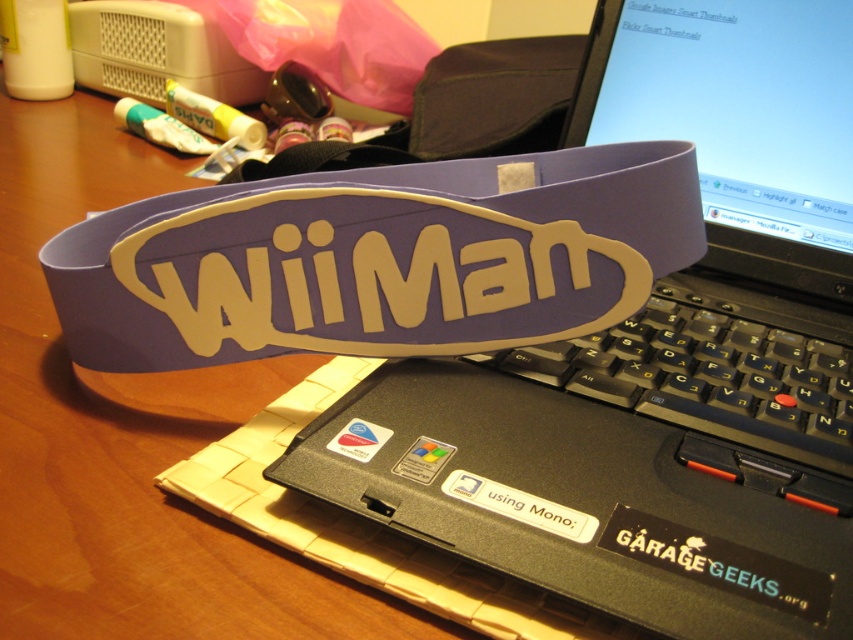
Question: Among these objects, which one is farthest from the camera?

Choices:
 (A) black plastic laptop at center
 (B) black plastic keyboard at center

Answer: (B)

Question: Can you confirm if black plastic laptop at center is positioned below black plastic keyboard at center?

Choices:
 (A) no
 (B) yes

Answer: (A)

Question: In this image, where is black plastic laptop at center located relative to black plastic keyboard at center?

Choices:
 (A) right
 (B) left

Answer: (B)

Question: Which point is closer to the camera?

Choices:
 (A) (817, 227)
 (B) (711, 300)

Answer: (B)

Question: Can you confirm if black plastic laptop at center is wider than black plastic keyboard at center?

Choices:
 (A) no
 (B) yes

Answer: (B)